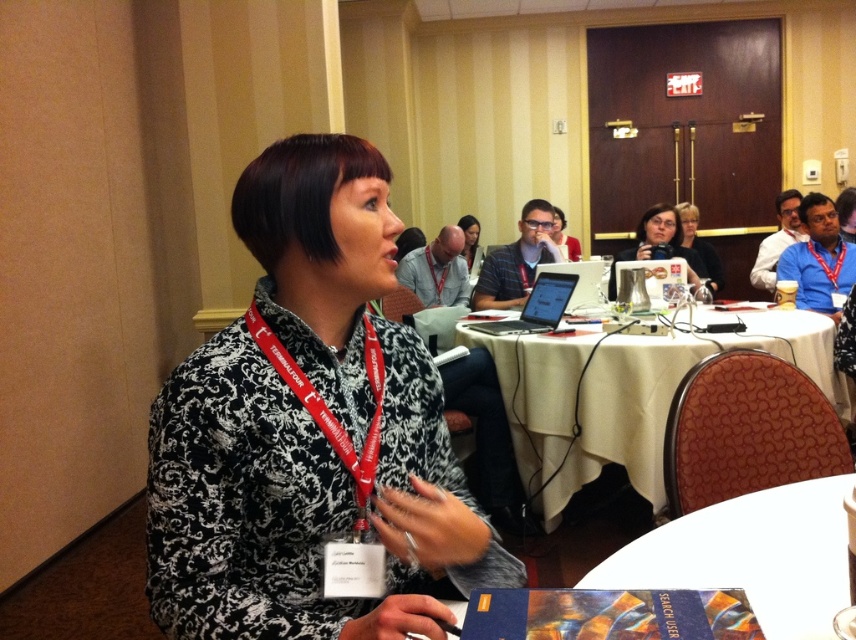
Question: Does white glossy mug at upper right have a lesser width compared to matte black shirt at center?

Choices:
 (A) yes
 (B) no

Answer: (B)

Question: Does blue lanyard at upper right appear under black matte laptop at center?

Choices:
 (A) no
 (B) yes

Answer: (A)

Question: Can you confirm if white glossy book at lower center is wider than matte black laptop at center?

Choices:
 (A) yes
 (B) no

Answer: (A)

Question: Estimate the real-world distances between objects in this image. Which object is farther from the white fabric table at center?

Choices:
 (A) matte black shirt at center
 (B) blue lanyard at upper right
 (C) matte black laptop at center
 (D) black printed shirt at center

Answer: (A)

Question: Which point is closer to the camera taking this photo?

Choices:
 (A) (223, 342)
 (B) (658, 208)
 (C) (496, 284)

Answer: (A)

Question: Estimate the real-world distances between objects in this image. Which object is farther from the black matte laptop at center?

Choices:
 (A) white glossy book at lower center
 (B) matte black shirt at center
 (C) black printed shirt at center
 (D) blue lanyard at upper right

Answer: (B)